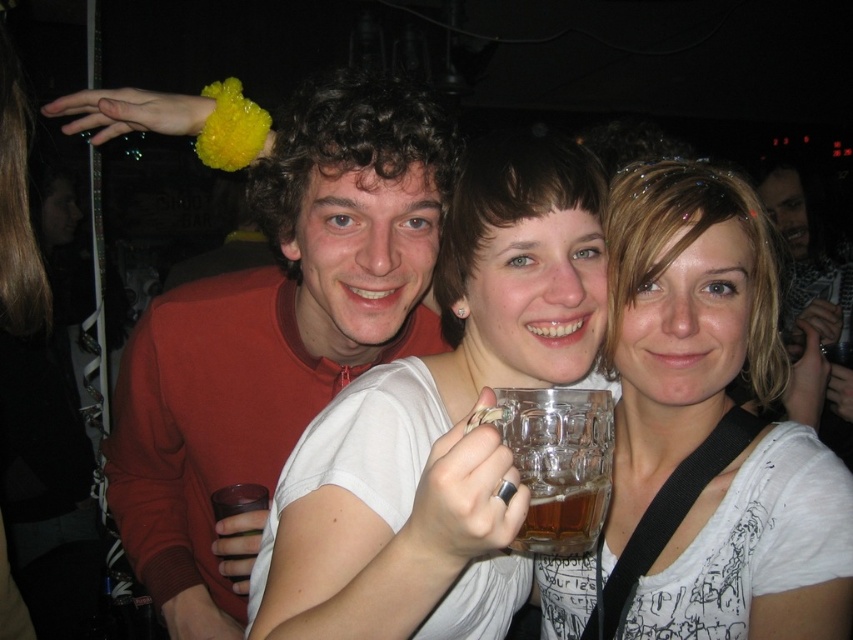
Question: Which of these objects is positioned farthest from the matte red sweater at center?

Choices:
 (A) white matte shirt at center
 (B) matte white shirt at center
 (C) transparent glass mug at center

Answer: (C)

Question: Is matte red sweater at center thinner than white matte shirt at center?

Choices:
 (A) no
 (B) yes

Answer: (A)

Question: Estimate the real-world distances between objects in this image. Which object is closer to the matte white shirt at center?

Choices:
 (A) white matte shirt at center
 (B) matte red sweater at center
 (C) transparent glass mug at center

Answer: (A)

Question: Which is nearer to the matte white shirt at center?

Choices:
 (A) white matte shirt at center
 (B) matte red sweater at center

Answer: (A)

Question: Considering the relative positions of matte red sweater at center and transparent glass mug at center in the image provided, where is matte red sweater at center located with respect to transparent glass mug at center?

Choices:
 (A) above
 (B) below

Answer: (A)

Question: Can you confirm if white matte shirt at center is smaller than matte white shirt at center?

Choices:
 (A) yes
 (B) no

Answer: (A)